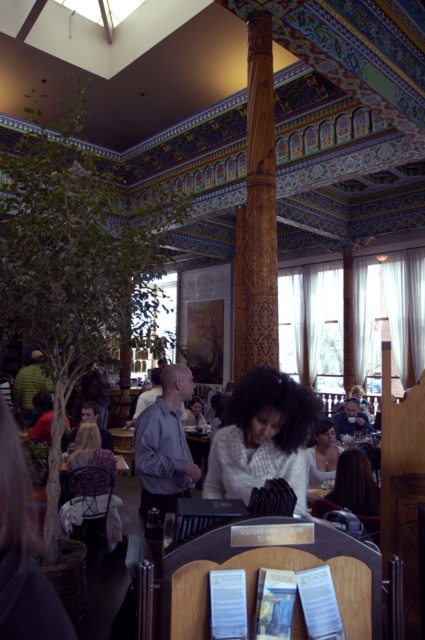
Question: Which object is the closest to the smooth white blouse at center?

Choices:
 (A) matte black hair at center
 (B) plaid fabric chair at lower left

Answer: (A)

Question: In this image, where is white matte sweater at center located relative to dark brown hair at lower right?

Choices:
 (A) left
 (B) right

Answer: (A)

Question: Is white matte sweater at center smaller than dark brown hair at lower right?

Choices:
 (A) yes
 (B) no

Answer: (B)

Question: Does matte black hair at center come behind dark brown hair at lower right?

Choices:
 (A) no
 (B) yes

Answer: (B)

Question: Which point is closer to the camera?

Choices:
 (A) dark brown hair at lower right
 (B) white matte sweater at center
 (C) matte black hair at center

Answer: (B)

Question: Which point appears closest to the camera in this image?

Choices:
 (A) (195, 403)
 (B) (255, 406)

Answer: (B)